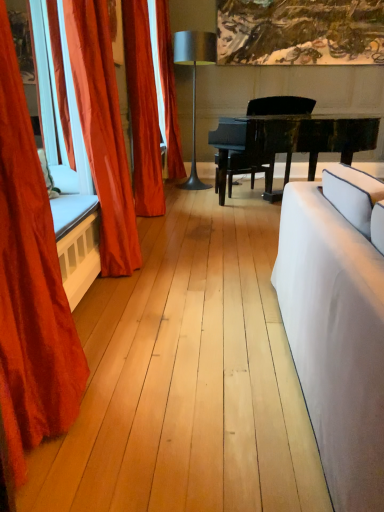
You are a GUI agent. You are given a task and a screenshot of the screen. Output one action in this format:
    pyautogui.click(x=<x>, y=<y>)
    Task: Click on the black polished piano at center
    The width and height of the screenshot is (384, 512).
    Given the screenshot: What is the action you would take?
    pyautogui.click(x=309, y=136)

Measure the distance between point (96,185) and camera.

The depth of point (96,185) is 2.55 meters.

What is the approximate width of satin orange curtain at left, placed as the 3th curtain when sorted from back to front?

satin orange curtain at left, placed as the 3th curtain when sorted from back to front, is 37.15 centimeters wide.

What are the coordinates of `velvet orange curtain at center, which is the 1th curtain from back to front` in the screenshot? It's located at click(168, 91).

Identify the location of metallic silver lamp at center. Image resolution: width=384 pixels, height=512 pixels. (194, 82).

From the image's perspective, is black polished piano at center beneath metallic silver lamp at center?

Yes.

What's the angular difference between black polished piano at center and metallic silver lamp at center's facing directions?

The facing directions of black polished piano at center and metallic silver lamp at center are 32.5 degrees apart.

Considering the positions of objects black polished piano at center and metallic silver lamp at center in the image provided, who is in front, black polished piano at center or metallic silver lamp at center?

black polished piano at center is in front.

Does point (250, 141) lie behind point (180, 39)?

That is False.

Between metallic silver lamp at center and white fabric couch at right, which one appears on the right side from the viewer's perspective?

white fabric couch at right is more to the right.

Is metallic silver lamp at center completely or partially outside of white fabric couch at right?

Indeed, metallic silver lamp at center is completely outside white fabric couch at right.

Can you tell me how much metallic silver lamp at center and white fabric couch at right differ in facing direction?

90.3 degrees.

In the scene shown: Is the depth of metallic silver lamp at center less than that of white fabric couch at right?

That is False.

Is the surface of white fabric couch at right in direct contact with satin orange curtain at left, the 2th curtain in the front-to-back sequence?

There is a gap between white fabric couch at right and satin orange curtain at left, the 2th curtain in the front-to-back sequence.

Based on the photo, can you confirm if white fabric couch at right is positioned to the right of satin orange curtain at left, the 2th curtain in the front-to-back sequence?

Indeed, white fabric couch at right is positioned on the right side of satin orange curtain at left, the 2th curtain in the front-to-back sequence.

Relative to satin orange curtain at left, the 2th curtain in the front-to-back sequence, is white fabric couch at right in front or behind?

Visually, white fabric couch at right is located in front of satin orange curtain at left, the 2th curtain in the front-to-back sequence.

From a real-world perspective, is white fabric couch at right positioned above or below satin orange curtain at left, the 2th curtain in the front-to-back sequence?

From a real-world perspective, white fabric couch at right is physically below satin orange curtain at left, the 2th curtain in the front-to-back sequence.

From the image's perspective, does velvet orange curtain at center, which is the 1th curtain from back to front, appear lower than satin orange curtain at left, placed as the 3th curtain when sorted from back to front?

Actually, velvet orange curtain at center, which is the 1th curtain from back to front, appears above satin orange curtain at left, placed as the 3th curtain when sorted from back to front, in the image.

Which object is more forward, velvet orange curtain at center, which is the 1th curtain from back to front, or satin orange curtain at left, the 2th curtain in the front-to-back sequence?

satin orange curtain at left, the 2th curtain in the front-to-back sequence, is closer to the camera.

Considering the sizes of objects velvet orange curtain at center, which is the 1th curtain from back to front, and satin orange curtain at left, placed as the 3th curtain when sorted from back to front, in the image provided, who is taller, velvet orange curtain at center, which is the 1th curtain from back to front, or satin orange curtain at left, placed as the 3th curtain when sorted from back to front,?

Standing taller between the two is velvet orange curtain at center, which is the 1th curtain from back to front.

Is black polished piano at center completely or partially inside velvet orange curtain at center, which is the fourth curtain in front-to-back order?

No, black polished piano at center is not a part of velvet orange curtain at center, which is the fourth curtain in front-to-back order.

Can you confirm if velvet orange curtain at center, which is the fourth curtain in front-to-back order, is taller than black polished piano at center?

Yes.

Is velvet orange curtain at center, which is the fourth curtain in front-to-back order, placed right next to black polished piano at center?

No, velvet orange curtain at center, which is the fourth curtain in front-to-back order, is not in contact with black polished piano at center.

Is velvet orange curtain at center, which is the 1th curtain from back to front, oriented away from black polished piano at center?

velvet orange curtain at center, which is the 1th curtain from back to front, does not have its back to black polished piano at center.

Is black polished piano at center far away from satin orange curtain at left, placed as the 3th curtain when sorted from back to front?

black polished piano at center is far away from satin orange curtain at left, placed as the 3th curtain when sorted from back to front.

How much distance is there between black polished piano at center and satin orange curtain at left, the 2th curtain in the front-to-back sequence?

black polished piano at center is 11.05 feet away from satin orange curtain at left, the 2th curtain in the front-to-back sequence.

Is black polished piano at center looking in the opposite direction of satin orange curtain at left, placed as the 3th curtain when sorted from back to front?

That's not correct — black polished piano at center is not looking away from satin orange curtain at left, placed as the 3th curtain when sorted from back to front.

From a real-world perspective, relative to satin orange curtain at left, the 2th curtain in the front-to-back sequence, is black polished piano at center vertically above or below?

In terms of real-world spatial position, black polished piano at center is below satin orange curtain at left, the 2th curtain in the front-to-back sequence.

Considering the sizes of satin orange curtain at left, marked as the third curtain in a front-to-back arrangement, and satin orange curtain at left, placed as the 3th curtain when sorted from back to front, in the image, is satin orange curtain at left, marked as the third curtain in a front-to-back arrangement, wider or thinner than satin orange curtain at left, placed as the 3th curtain when sorted from back to front,?

Considering their sizes, satin orange curtain at left, marked as the third curtain in a front-to-back arrangement, looks slimmer than satin orange curtain at left, placed as the 3th curtain when sorted from back to front.

From the image's perspective, which is below, satin orange curtain at left, which is the second curtain from back to front, or satin orange curtain at left, placed as the 3th curtain when sorted from back to front?

From the image's view, satin orange curtain at left, placed as the 3th curtain when sorted from back to front, is below.

Can you tell me how much satin orange curtain at left, marked as the third curtain in a front-to-back arrangement, and satin orange curtain at left, the 2th curtain in the front-to-back sequence, differ in facing direction?

The angular difference between satin orange curtain at left, marked as the third curtain in a front-to-back arrangement, and satin orange curtain at left, the 2th curtain in the front-to-back sequence, is 0.361 degrees.

Would you say satin orange curtain at left, marked as the third curtain in a front-to-back arrangement, is inside or outside satin orange curtain at left, the 2th curtain in the front-to-back sequence?

satin orange curtain at left, marked as the third curtain in a front-to-back arrangement, lies outside satin orange curtain at left, the 2th curtain in the front-to-back sequence.

The width and height of the screenshot is (384, 512). In order to click on lamp on the left of black polished piano at center in this screenshot , I will do `click(194, 82)`.

You are a GUI agent. You are given a task and a screenshot of the screen. Output one action in this format:
    pyautogui.click(x=<x>, y=<y>)
    Task: Click on the lamp behind the white fabric couch at right
    Image resolution: width=384 pixels, height=512 pixels.
    Given the screenshot: What is the action you would take?
    pyautogui.click(x=194, y=82)

In the scene shown: Looking at the image, which one is located further to white fabric couch at right, black polished piano at center or velvet red curtain at left, arranged as the 4th curtain when viewed from the back?

black polished piano at center is further to white fabric couch at right.

Looking at the image, which one is located further to velvet orange curtain at center, which is the fourth curtain in front-to-back order, satin orange curtain at left, marked as the third curtain in a front-to-back arrangement, or black polished piano at center?

satin orange curtain at left, marked as the third curtain in a front-to-back arrangement, lies further to velvet orange curtain at center, which is the fourth curtain in front-to-back order, than the other object.

From the picture: Estimate the real-world distances between objects in this image. Which object is further from velvet orange curtain at center, which is the 1th curtain from back to front, white fabric couch at right or satin orange curtain at left, which is the second curtain from back to front?

white fabric couch at right.

Looking at this image, from the image, which object appears to be nearer to velvet orange curtain at center, which is the fourth curtain in front-to-back order, satin orange curtain at left, the 2th curtain in the front-to-back sequence, or black polished piano at center?

The object closer to velvet orange curtain at center, which is the fourth curtain in front-to-back order, is black polished piano at center.

From the image, which object appears to be farther from black polished piano at center, white fabric couch at right or satin orange curtain at left, which is the second curtain from back to front?

Among the two, white fabric couch at right is located further to black polished piano at center.

From the image, which object appears to be farther from black polished piano at center, velvet red curtain at left, marked as the 1th curtain in a front-to-back arrangement, or metallic silver lamp at center?

velvet red curtain at left, marked as the 1th curtain in a front-to-back arrangement, is positioned further to the anchor black polished piano at center.

From the image, which object appears to be nearer to black polished piano at center, velvet orange curtain at center, which is the 1th curtain from back to front, or satin orange curtain at left, marked as the third curtain in a front-to-back arrangement?

Based on the image, velvet orange curtain at center, which is the 1th curtain from back to front, appears to be nearer to black polished piano at center.

Estimate the real-world distances between objects in this image. Which object is further from satin orange curtain at left, the 2th curtain in the front-to-back sequence, black polished piano at center or metallic silver lamp at center?

metallic silver lamp at center is further to satin orange curtain at left, the 2th curtain in the front-to-back sequence.

Identify the location of table located between velvet red curtain at left, marked as the 1th curtain in a front-to-back arrangement, and satin orange curtain at left, marked as the third curtain in a front-to-back arrangement, in the depth direction. (309, 136).

Where is `table between satin orange curtain at left, placed as the 3th curtain when sorted from back to front, and velvet orange curtain at center, which is the 1th curtain from back to front, along the z-axis`? table between satin orange curtain at left, placed as the 3th curtain when sorted from back to front, and velvet orange curtain at center, which is the 1th curtain from back to front, along the z-axis is located at coordinates (309, 136).

The width and height of the screenshot is (384, 512). I want to click on curtain located between satin orange curtain at left, marked as the third curtain in a front-to-back arrangement, and black polished piano at center in the left-right direction, so click(168, 91).

The height and width of the screenshot is (512, 384). In order to click on lamp between black polished piano at center and velvet orange curtain at center, which is the fourth curtain in front-to-back order, from front to back in this screenshot , I will do `click(194, 82)`.